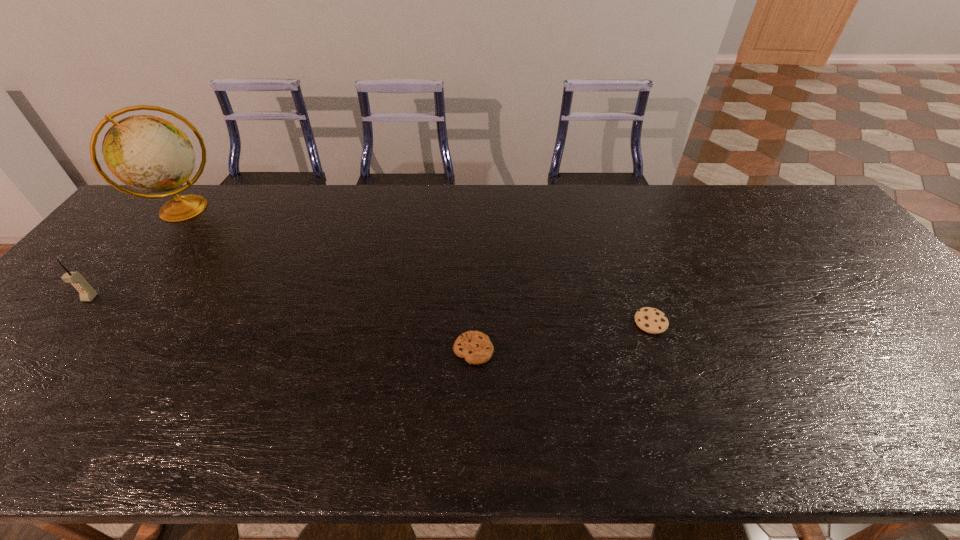
The height and width of the screenshot is (540, 960). Identify the location of vacant area in the image that satisfies the following two spatial constraints: 1. on the front of the second tallest object, where the keypad is located; 2. on the right side of the second object from right to left. (46, 350).

Where is `vacant space that satisfies the following two spatial constraints: 1. on the front of the cellular telephone, where the keypad is located; 2. on the right side of the left cookie`? This screenshot has width=960, height=540. vacant space that satisfies the following two spatial constraints: 1. on the front of the cellular telephone, where the keypad is located; 2. on the right side of the left cookie is located at coordinates (46, 350).

You are a GUI agent. You are given a task and a screenshot of the screen. Output one action in this format:
    pyautogui.click(x=<x>, y=<y>)
    Task: Click on the free region that satisfies the following two spatial constraints: 1. on the front of the right cookie, where the keypad is located; 2. on the left side of the cellular telephone
    The height and width of the screenshot is (540, 960).
    Given the screenshot: What is the action you would take?
    pyautogui.click(x=69, y=322)

Where is `free space that satisfies the following two spatial constraints: 1. on the front of the second object from right to left, where the keypad is located; 2. on the left side of the cellular telephone`? The width and height of the screenshot is (960, 540). free space that satisfies the following two spatial constraints: 1. on the front of the second object from right to left, where the keypad is located; 2. on the left side of the cellular telephone is located at coordinates (46, 350).

Locate an element on the screen. This screenshot has width=960, height=540. vacant space that satisfies the following two spatial constraints: 1. on the front of the cellular telephone, where the keypad is located; 2. on the right side of the right cookie is located at coordinates (69, 322).